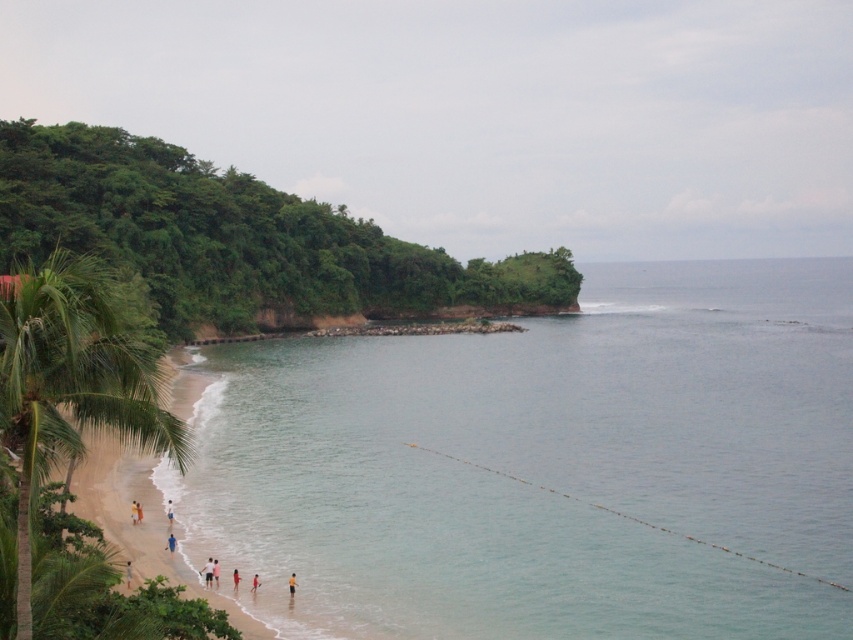
Question: Which object is farther from the camera taking this photo?

Choices:
 (A) red fabric person at lower center
 (B) light pink fabric at lower center
 (C) reddish-orange fabric at lower center
 (D) clear blue water at lower left

Answer: (B)

Question: Which point is farther to the camera?

Choices:
 (A) (138, 515)
 (B) (135, 513)

Answer: (B)

Question: Which object is positioned closest to the light brown sand at lower left?

Choices:
 (A) green leafy palm tree at left
 (B) light blue fabric shorts at lower center
 (C) white cotton shirt at lower left

Answer: (B)

Question: Does light blue fabric shorts at lower center have a lesser width compared to blue fabric person at lower left?

Choices:
 (A) yes
 (B) no

Answer: (B)

Question: Can you confirm if yellow fabric person at lower center is positioned to the left of white fabric person at lower left?

Choices:
 (A) yes
 (B) no

Answer: (A)

Question: Is light brown skin at beach center bigger than blue fabric person at lower left?

Choices:
 (A) no
 (B) yes

Answer: (B)